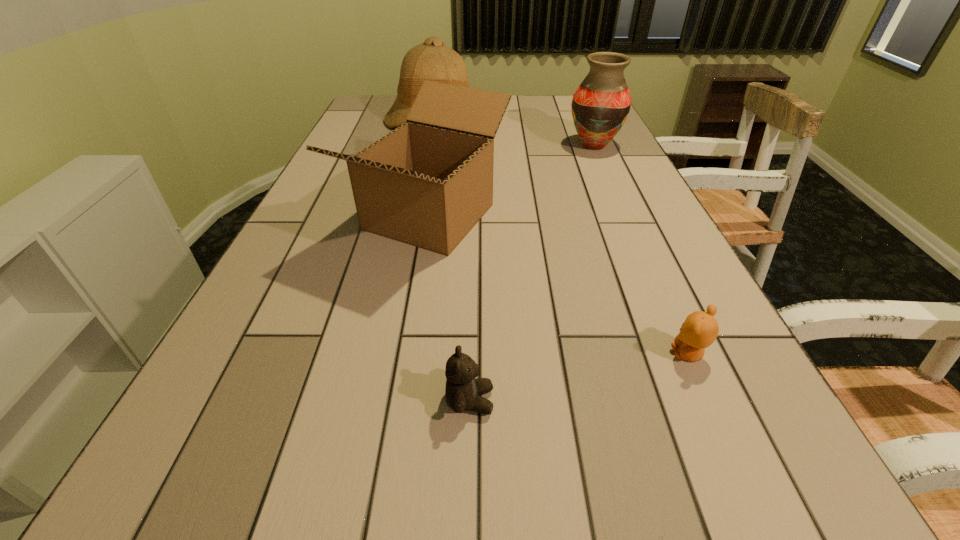
You are a GUI agent. You are given a task and a screenshot of the screen. Output one action in this format:
    pyautogui.click(x=<x>, y=<y>)
    Task: Click on the hat
    This screenshot has height=540, width=960.
    Given the screenshot: What is the action you would take?
    pyautogui.click(x=433, y=61)

The height and width of the screenshot is (540, 960). I want to click on vase, so click(x=601, y=104).

This screenshot has height=540, width=960. In order to click on box in this screenshot , I will do `click(427, 183)`.

The width and height of the screenshot is (960, 540). I want to click on the left teddy bear, so click(463, 391).

Identify the location of the nearest object. (463, 391).

In order to click on the farther teddy bear in this screenshot , I will do `click(700, 329)`.

This screenshot has height=540, width=960. In order to click on the right teddy bear in this screenshot , I will do `click(700, 329)`.

Where is `vacant space located on the front-facing side of the hat`? This screenshot has height=540, width=960. vacant space located on the front-facing side of the hat is located at coordinates (422, 169).

The image size is (960, 540). Identify the location of vacant space located 0.310m on the front of the vase. (625, 215).

Find the location of a particular element. Image resolution: width=960 pixels, height=540 pixels. free point located on the back of the third nearest object is located at coordinates (444, 126).